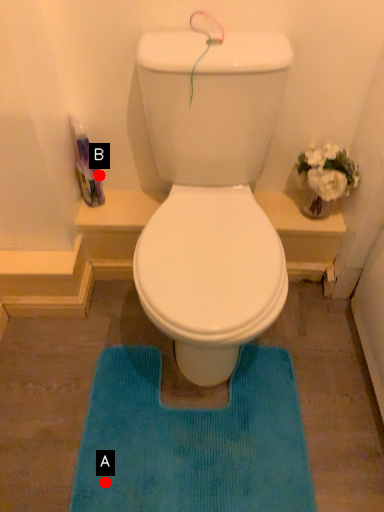
Question: Two points are circled on the image, labeled by A and B beside each circle. Which point appears closest to the camera in this image?

Choices:
 (A) A is closer
 (B) B is closer

Answer: (A)